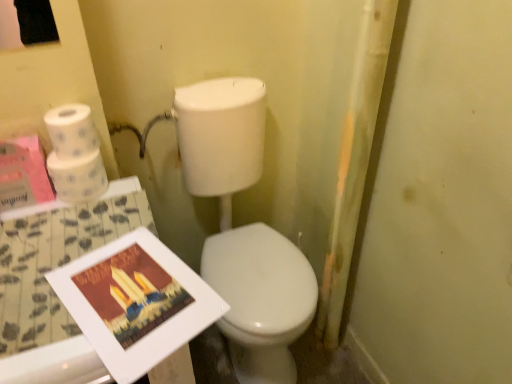
Question: Is white matte toilet paper at upper left, which is counted as the second toilet paper, starting from the bottom, thinner than white glossy table at lower left?

Choices:
 (A) yes
 (B) no

Answer: (A)

Question: Is white matte toilet paper at upper left, which is counted as the second toilet paper, starting from the bottom, outside white glossy table at lower left?

Choices:
 (A) no
 (B) yes

Answer: (B)

Question: Is white matte toilet paper at upper left, marked as the first toilet paper in a top-to-bottom arrangement, at the right side of white glossy table at lower left?

Choices:
 (A) no
 (B) yes

Answer: (B)

Question: From a real-world perspective, is white matte toilet paper at upper left, marked as the first toilet paper in a top-to-bottom arrangement, located beneath white glossy table at lower left?

Choices:
 (A) yes
 (B) no

Answer: (B)

Question: Is white matte toilet paper at upper left, which is counted as the second toilet paper, starting from the bottom, to the left of white glossy table at lower left from the viewer's perspective?

Choices:
 (A) yes
 (B) no

Answer: (B)

Question: From the image's perspective, relative to white glossy table at lower left, is matte paper magazine at lower left above or below?

Choices:
 (A) above
 (B) below

Answer: (A)

Question: Visually, is matte paper magazine at lower left positioned to the left or to the right of white glossy table at lower left?

Choices:
 (A) right
 (B) left

Answer: (A)

Question: From a real-world perspective, is matte paper magazine at lower left physically located above or below white glossy table at lower left?

Choices:
 (A) below
 (B) above

Answer: (B)

Question: Considering the positions of matte paper magazine at lower left and white glossy table at lower left in the image, is matte paper magazine at lower left wider or thinner than white glossy table at lower left?

Choices:
 (A) wide
 (B) thin

Answer: (B)

Question: Is point (84, 160) closer or farther from the camera than point (172, 253)?

Choices:
 (A) closer
 (B) farther

Answer: (B)

Question: From the image's perspective, is white matte toilet paper at upper left, arranged as the 2th toilet paper when viewed from the top, above or below matte paper magazine at lower left?

Choices:
 (A) above
 (B) below

Answer: (A)

Question: From their relative heights in the image, would you say white matte toilet paper at upper left, the 1th toilet paper positioned from the bottom, is taller or shorter than matte paper magazine at lower left?

Choices:
 (A) tall
 (B) short

Answer: (A)

Question: Relative to matte paper magazine at lower left, is white matte toilet paper at upper left, arranged as the 2th toilet paper when viewed from the top, in front or behind?

Choices:
 (A) behind
 (B) front

Answer: (A)

Question: Which is correct: matte paper magazine at lower left is inside white matte toilet paper at upper left, which is counted as the second toilet paper, starting from the bottom, or outside of it?

Choices:
 (A) inside
 (B) outside

Answer: (B)

Question: In terms of width, does matte paper magazine at lower left look wider or thinner when compared to white matte toilet paper at upper left, which is counted as the second toilet paper, starting from the bottom?

Choices:
 (A) wide
 (B) thin

Answer: (A)